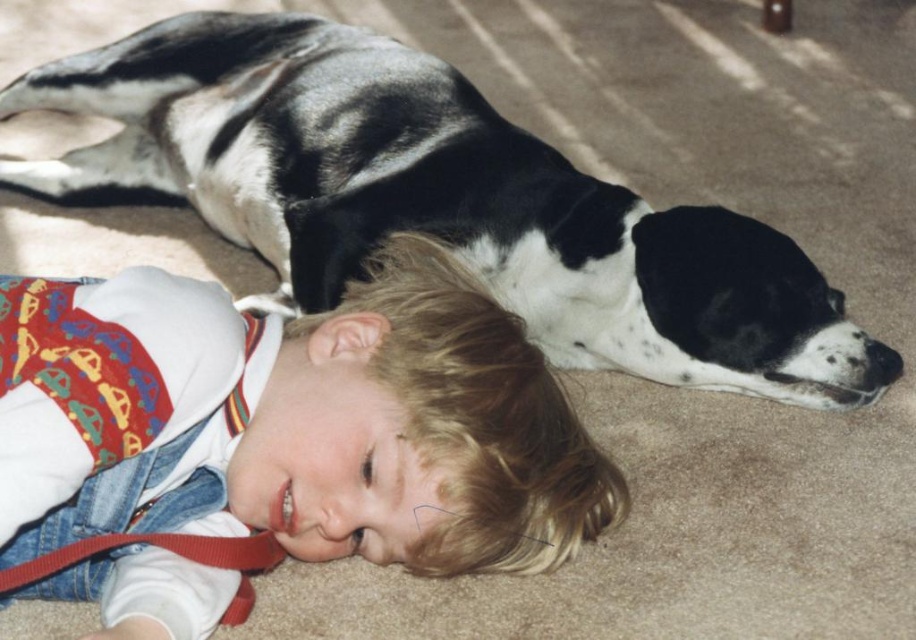
Question: Which object is closer to the camera taking this photo?

Choices:
 (A) black and white fur dog at upper center
 (B) denim overalls at lower left

Answer: (B)

Question: Considering the relative positions of denim overalls at lower left and black and white fur dog at upper center in the image provided, where is denim overalls at lower left located with respect to black and white fur dog at upper center?

Choices:
 (A) right
 (B) left

Answer: (B)

Question: Which point is closer to the camera taking this photo?

Choices:
 (A) (112, 470)
 (B) (506, 204)

Answer: (A)

Question: Is denim overalls at lower left above black and white fur dog at upper center?

Choices:
 (A) no
 (B) yes

Answer: (A)

Question: Can you confirm if denim overalls at lower left is positioned below black and white fur dog at upper center?

Choices:
 (A) no
 (B) yes

Answer: (B)

Question: Which point is closer to the camera?

Choices:
 (A) black and white fur dog at upper center
 (B) denim overalls at lower left

Answer: (B)